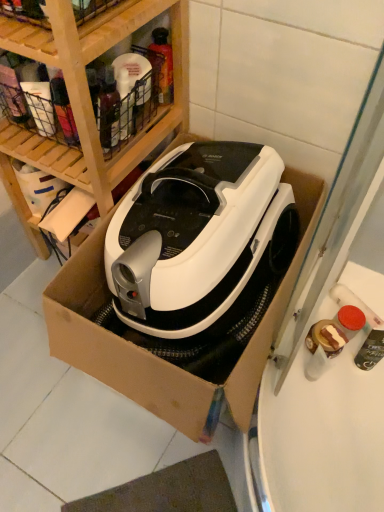
Find the location of a particular element. Image resolution: width=384 pixels, height=512 pixels. wooden at upper left is located at coordinates (89, 99).

What is the approximate height of white cardboard box at center?

It is 44.71 centimeters.

Find the location of `wooden at upper left`. wooden at upper left is located at coordinates (89, 99).

Can you see wooden at upper left touching translucent plastic spray bottle at upper center?

No, wooden at upper left is not beside translucent plastic spray bottle at upper center.

Is point (181, 51) closer to viewer compared to point (161, 52)?

Yes.

Would you say wooden at upper left contains translucent plastic spray bottle at upper center?

Yes, translucent plastic spray bottle at upper center is inside wooden at upper left.

From a real-world perspective, which is physically below, wooden at upper left or translucent plastic spray bottle at upper center?

From a 3D spatial view, wooden at upper left is below.

Is white cardboard box at center positioned far away from wooden at upper left?

They are positioned close to each other.

Is point (268, 315) more distant than point (131, 164)?

No, it is in front of (131, 164).

Is white cardboard box at center facing towards wooden at upper left?

No, white cardboard box at center is not facing towards wooden at upper left.

Is wooden at upper left a part of white cardboard box at center?

No, wooden at upper left is located outside of white cardboard box at center.

Can you confirm if translucent plastic spray bottle at upper center is thinner than white cardboard box at center?

Yes, translucent plastic spray bottle at upper center is thinner than white cardboard box at center.

Looking at this image, can you confirm if translucent plastic spray bottle at upper center is positioned to the left of white cardboard box at center?

Yes.

Where is `bottle on the left side of white cardboard box at center`? This screenshot has height=512, width=384. bottle on the left side of white cardboard box at center is located at coordinates (162, 64).

Is translucent plastic spray bottle at upper center in contact with white cardboard box at center?

No, translucent plastic spray bottle at upper center is not next to white cardboard box at center.

Which is correct: wooden at upper left is inside white cardboard box at center, or outside of it?

The correct answer is: outside.

In terms of size, does wooden at upper left appear bigger or smaller than white cardboard box at center?

A: Clearly, wooden at upper left is smaller in size than white cardboard box at center.

Identify the location of cardboard box below the wooden at upper left (from the image's perspective). The height and width of the screenshot is (512, 384). [117, 345].

From the image's perspective, relative to translucent plastic spray bottle at upper center, is white cardboard box at center above or below?

Based on their image positions, white cardboard box at center is located beneath translucent plastic spray bottle at upper center.

From a real-world perspective, which object stands above the other?

In real-world perspective, translucent plastic spray bottle at upper center is above.

I want to click on bottle located above the white cardboard box at center (from a real-world perspective), so click(162, 64).

Is white cardboard box at center to the left or to the right of translucent plastic spray bottle at upper center in the image?

white cardboard box at center is to the right of translucent plastic spray bottle at upper center.

Does point (152, 48) appear closer or farther from the camera than point (110, 206)?

Point (152, 48) is farther from the camera than point (110, 206).

Is translucent plastic spray bottle at upper center inside or outside of wooden at upper left?

translucent plastic spray bottle at upper center is enclosed within wooden at upper left.

The image size is (384, 512). What are the coordinates of `bottle above the wooden at upper left (from a real-world perspective)` in the screenshot? It's located at (162, 64).

Is translucent plastic spray bottle at upper center facing away from wooden at upper left?

Yes, translucent plastic spray bottle at upper center is facing away from wooden at upper left.

Identify the location of bottle to the right of wooden at upper left. (162, 64).

At what (x,y) coordinates should I click in order to perform the action: click on cardboard box behind the wooden at upper left. Please return your answer as a coordinate pair (x, y). Looking at the image, I should click on (117, 345).

Considering their positions, is white cardboard box at center positioned further to translucent plastic spray bottle at upper center than wooden at upper left?

white cardboard box at center lies further to translucent plastic spray bottle at upper center than the other object.

Based on their spatial positions, is translucent plastic spray bottle at upper center or wooden at upper left closer to white cardboard box at center?

wooden at upper left.

Considering their positions, is white cardboard box at center positioned closer to wooden at upper left than translucent plastic spray bottle at upper center?

The object closer to wooden at upper left is translucent plastic spray bottle at upper center.

Looking at the image, which one is located further to wooden at upper left, translucent plastic spray bottle at upper center or white cardboard box at center?

white cardboard box at center is positioned further to the anchor wooden at upper left.

Considering their positions, is wooden at upper left positioned closer to white cardboard box at center than translucent plastic spray bottle at upper center?

Among the two, wooden at upper left is located nearer to white cardboard box at center.

Consider the image. From the image, which object appears to be nearer to translucent plastic spray bottle at upper center, wooden at upper left or white cardboard box at center?

wooden at upper left is positioned closer to the anchor translucent plastic spray bottle at upper center.

Find the location of a particular element. shelf between translucent plastic spray bottle at upper center and white cardboard box at center in the up-down direction is located at coordinates (89, 99).